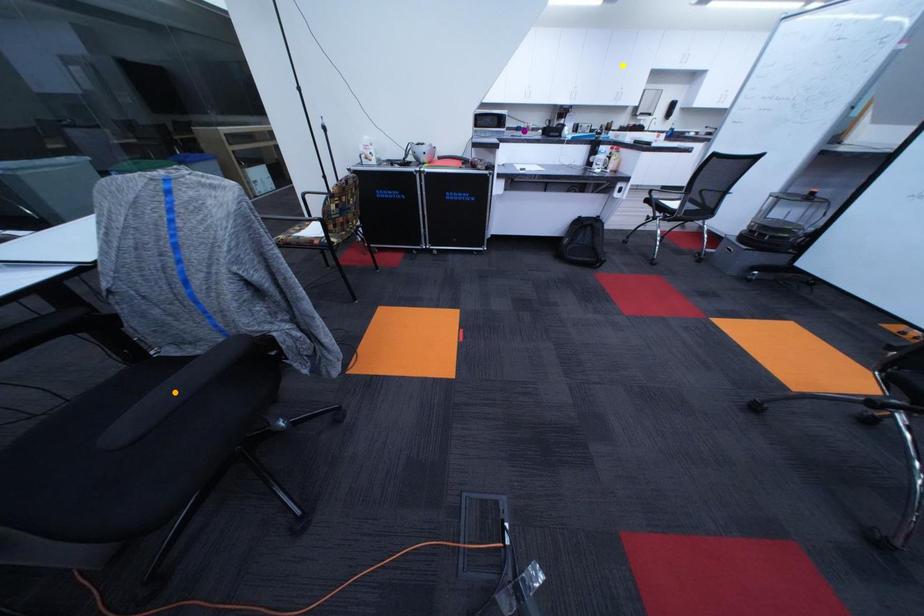
Order these from nearest to farthest:
A) orange point
B) purple point
C) yellow point

orange point, purple point, yellow point